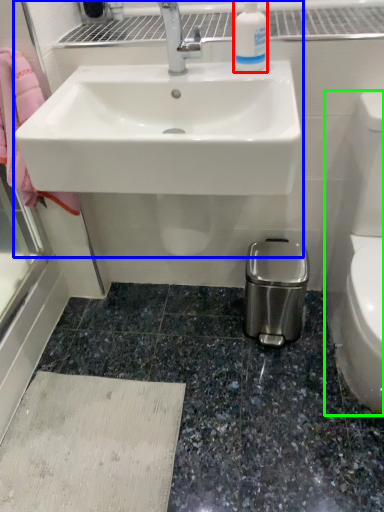
Question: Considering the real-world distances, which object is farthest from cleaning product (highlighted by a red box)? sink (highlighted by a blue box) or toilet bowl (highlighted by a green box)?

Choices:
 (A) sink
 (B) toilet bowl

Answer: (B)